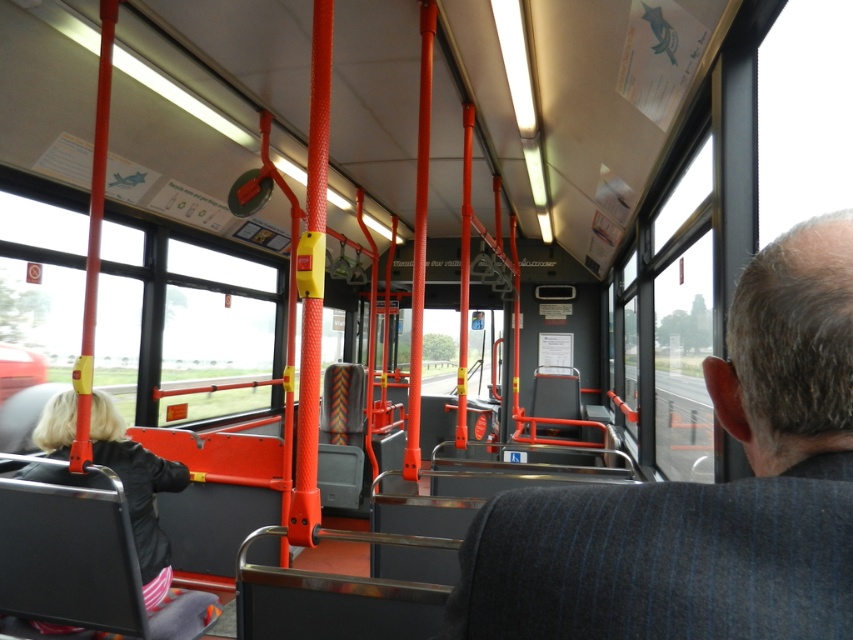
In the scene shown: You are a passenger on a public bus and notice two items inside the vehicle. You see the matte black coach at center and the black fabric jacket at lower left. Which item is positioned to the right side of the other?

The matte black coach at center is to the right of black fabric jacket at lower left.

You are a passenger on a public bus and notice two items in the scene. One is the matte black coach at center and the other is the black fabric jacket at lower left. Which of these two items is taller?

The black fabric jacket at lower left is taller than the matte black coach at center.